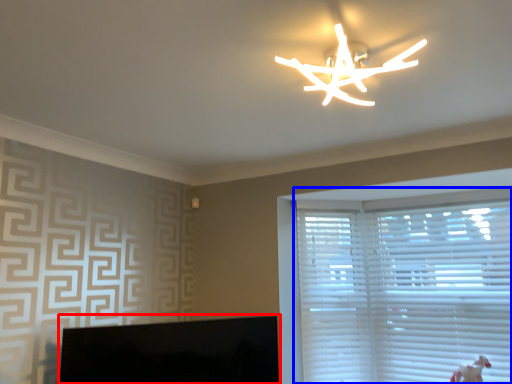
Question: Which object is closer to the camera taking this photo, computer monitor (highlighted by a red box) or window blind (highlighted by a blue box)?

Choices:
 (A) computer monitor
 (B) window blind

Answer: (A)